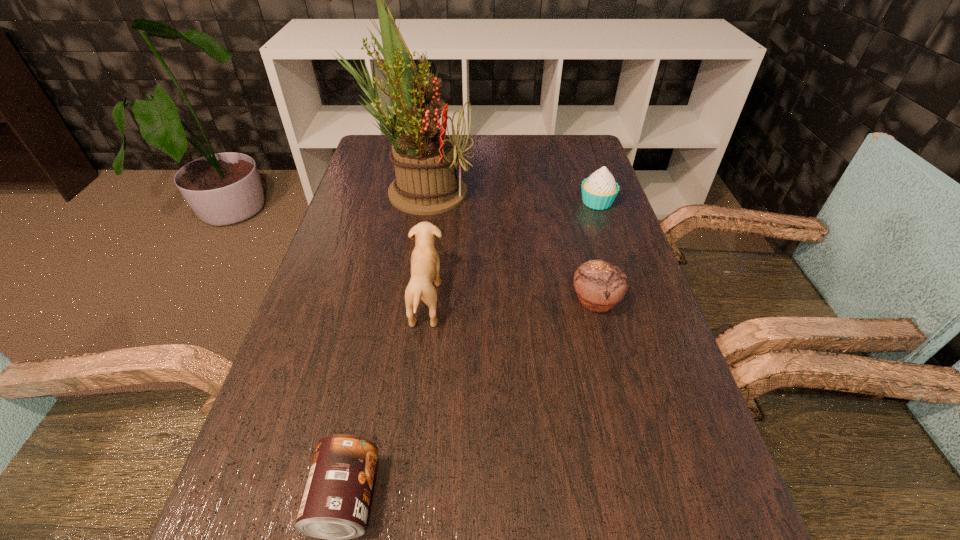
Where is `cupcake at the right edge`? The width and height of the screenshot is (960, 540). cupcake at the right edge is located at coordinates (599, 191).

I want to click on muffin situated at the right edge, so click(x=599, y=285).

Locate an element on the screen. The image size is (960, 540). object that is at the far left corner is located at coordinates (425, 160).

Image resolution: width=960 pixels, height=540 pixels. Find the location of `free space at the left edge of the desktop`. free space at the left edge of the desktop is located at coordinates (356, 382).

You are a GUI agent. You are given a task and a screenshot of the screen. Output one action in this format:
    pyautogui.click(x=<x>, y=<y>)
    Task: Click on the free space at the right edge of the desktop
    
    Given the screenshot: What is the action you would take?
    pyautogui.click(x=608, y=386)

What are the coordinates of `free spot between the muffin and the puppy` in the screenshot? It's located at (511, 301).

Image resolution: width=960 pixels, height=540 pixels. What are the coordinates of `empty location between the muffin and the cupcake` in the screenshot? It's located at (596, 252).

Where is `free space between the cupcake and the tallest object`? The image size is (960, 540). free space between the cupcake and the tallest object is located at coordinates (508, 197).

Where is `object that is the nearest to the cupcake`? object that is the nearest to the cupcake is located at coordinates (599, 285).

Select which object appears as the third closest to the tallest object. Please provide its 2D coordinates. Your answer should be formatted as a tuple, i.e. [(x, y)], where the tuple contains the x and y coordinates of a point satisfying the conditions above.

[(599, 285)]